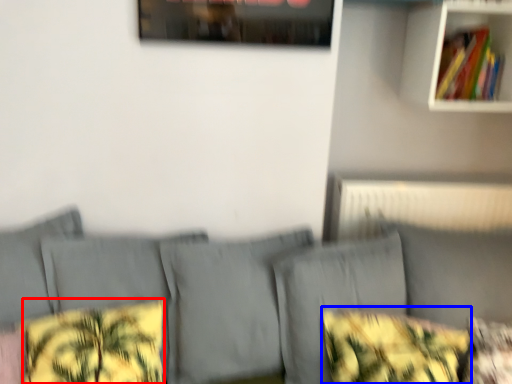
Question: Which of the following is the closest to the observer, pillow (highlighted by a red box) or throw pillow (highlighted by a blue box)?

Choices:
 (A) pillow
 (B) throw pillow

Answer: (A)